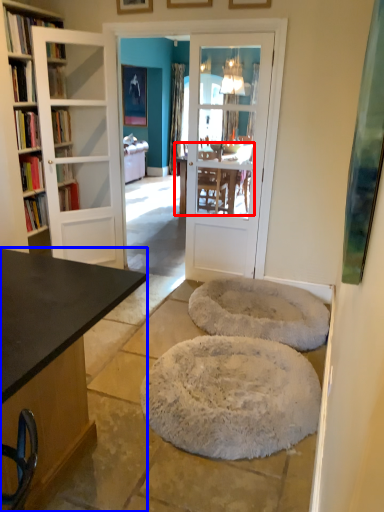
Question: Which point is closer to the camera, kitchen & dining room table (highlighted by a red box) or desk (highlighted by a blue box)?

Choices:
 (A) kitchen & dining room table
 (B) desk

Answer: (B)